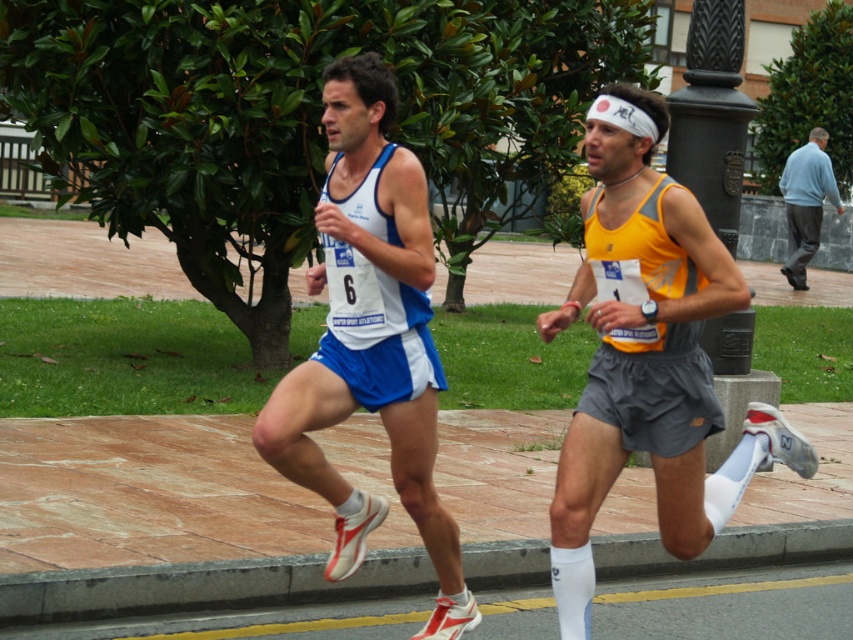
Question: Which point is farther to the camera?

Choices:
 (A) gray concrete curb at lower center
 (B) light blue sweater at right

Answer: (B)

Question: Which point is farther to the camera?

Choices:
 (A) gray concrete curb at lower center
 (B) light blue sweater at right

Answer: (B)

Question: Does gray concrete curb at lower center have a lesser width compared to light blue sweater at right?

Choices:
 (A) yes
 (B) no

Answer: (B)

Question: Among these objects, which one is farthest from the camera?

Choices:
 (A) gray concrete curb at lower center
 (B) light blue sweater at right

Answer: (B)

Question: Where is gray concrete curb at lower center located in relation to light blue sweater at right in the image?

Choices:
 (A) above
 (B) below

Answer: (B)

Question: Can you confirm if gray concrete curb at lower center is positioned to the right of light blue sweater at right?

Choices:
 (A) no
 (B) yes

Answer: (A)